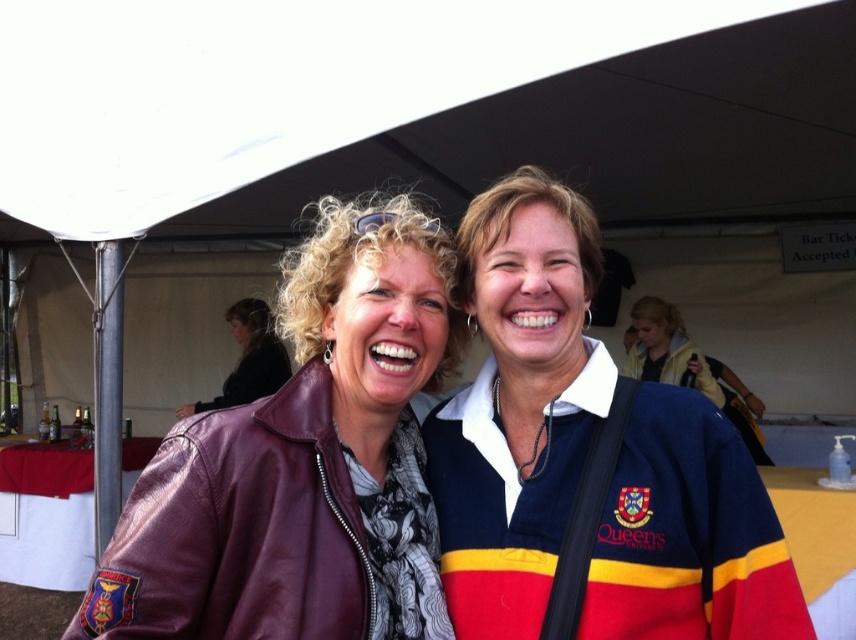
Question: Is white fabric canopy at upper center smaller than matte leather jacket at center?

Choices:
 (A) yes
 (B) no

Answer: (B)

Question: Among these objects, which one is nearest to the camera?

Choices:
 (A) dark brown leather jacket at center
 (B) white fabric canopy at upper center

Answer: (B)

Question: Among these points, which one is farthest from the camera?

Choices:
 (A) click(513, 214)
 (B) click(608, 84)

Answer: (B)

Question: Can you confirm if navy blue jersey at center is positioned to the left of matte leather jacket at center?

Choices:
 (A) yes
 (B) no

Answer: (B)

Question: Which point is closer to the camera?

Choices:
 (A) (290, 435)
 (B) (614, 67)
 (C) (263, 328)
 (D) (545, 220)

Answer: (A)

Question: Can you confirm if matte leather jacket at center is positioned above dark brown leather jacket at center?

Choices:
 (A) yes
 (B) no

Answer: (B)